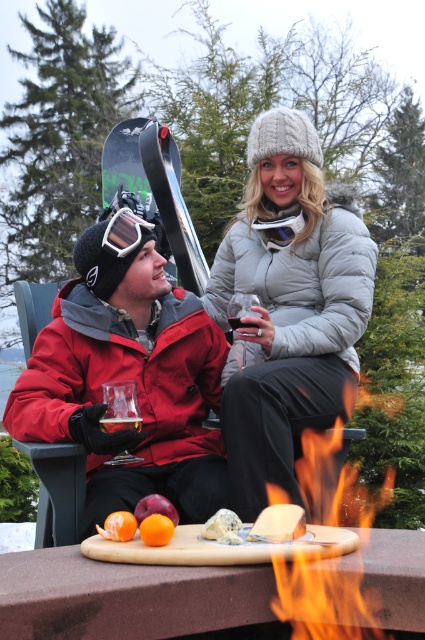
From the picture: You are standing in the winter scene and want to throw a snowball. You have two points to choose from, point [124,371] and point [136,516]. Which point is closer to you where you can throw the snowball more easily?

Point [124,371] is further to the camera than point [136,516], so point [136,516] is closer to you and easier to throw the snowball at.